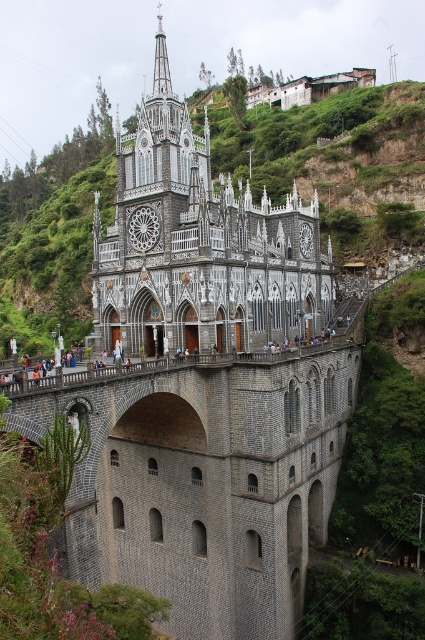
Does gray stone bridge at center lie behind gray stone tower at center?

No.

Is point (263, 496) in front of point (260, 209)?

Yes, it is.

The height and width of the screenshot is (640, 425). Find the location of `gray stone bridge at center`. gray stone bridge at center is located at coordinates (204, 477).

Locate an element on the screen. Image resolution: width=425 pixels, height=640 pixels. gray stone bridge at center is located at coordinates (204, 477).